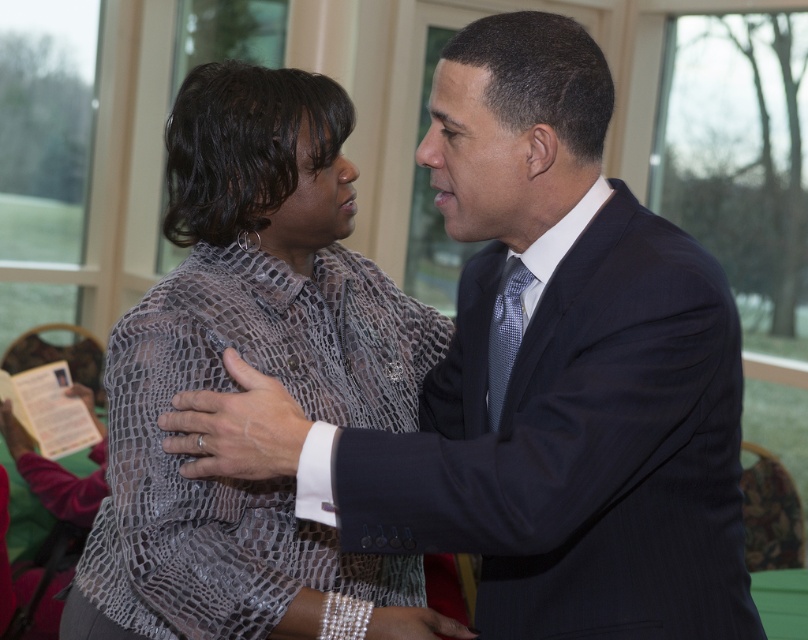
You are a photographer at a formal event and need to frame a photo of the dark blue suit at center and the silvery textured tie at center. Which object should you adjust your camera to focus on first if you want to capture the wider one first?

The dark blue suit at center is wider than the silvery textured tie at center, so you should focus on the dark blue suit at center first.

You are standing in the room and want to determine which of the two points, point (344, 474) or point (507, 355), is closer to you. Based on the scene description, which point is nearer?

Point (344, 474) is closer to the viewer than point (507, 355).

You are organizing a photo shoot and need to ensure that all attire items are arranged properly. Given the dark blue suit at center and the silvery textured tie at center, which item should be placed higher on the rack to match their actual sizes?

The dark blue suit at center should be placed higher on the rack since it has a greater height compared to the silvery textured tie at center.